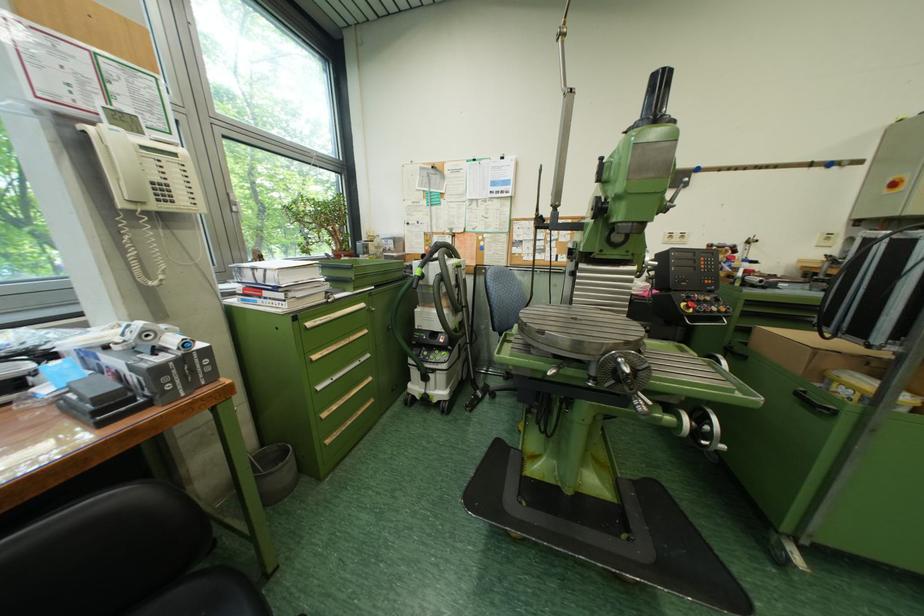
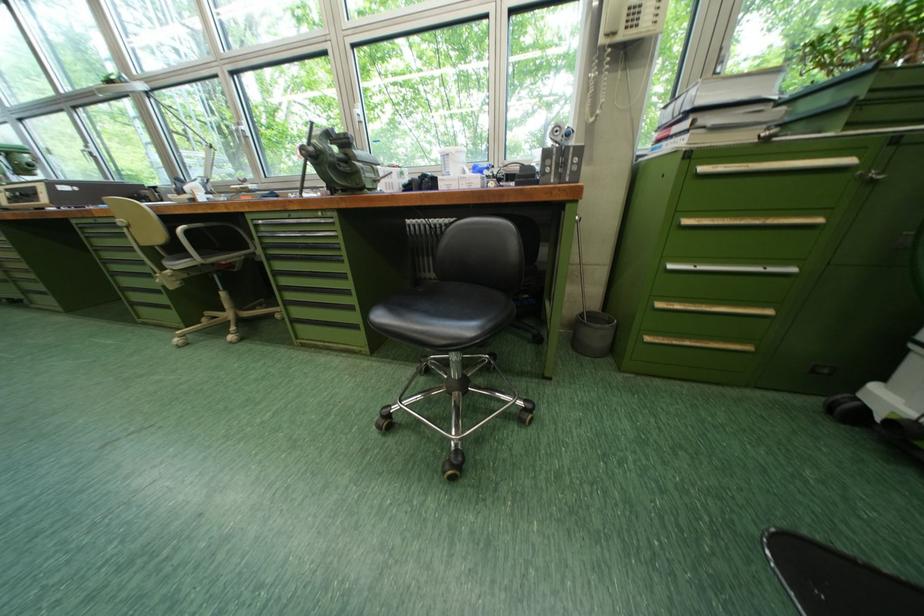
The point at [325,360] is marked in the first image. Where is the corresponding point in the second image?

(698, 224)